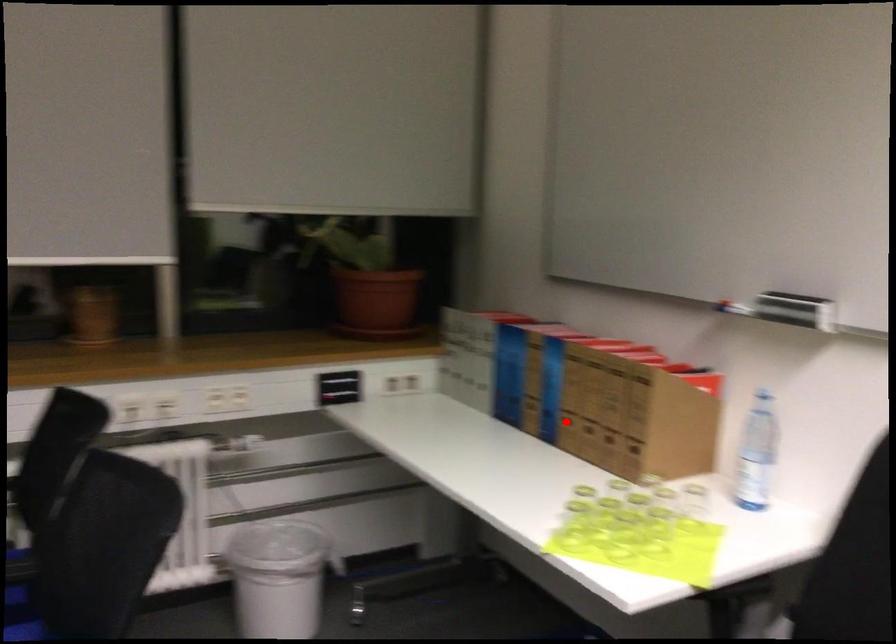
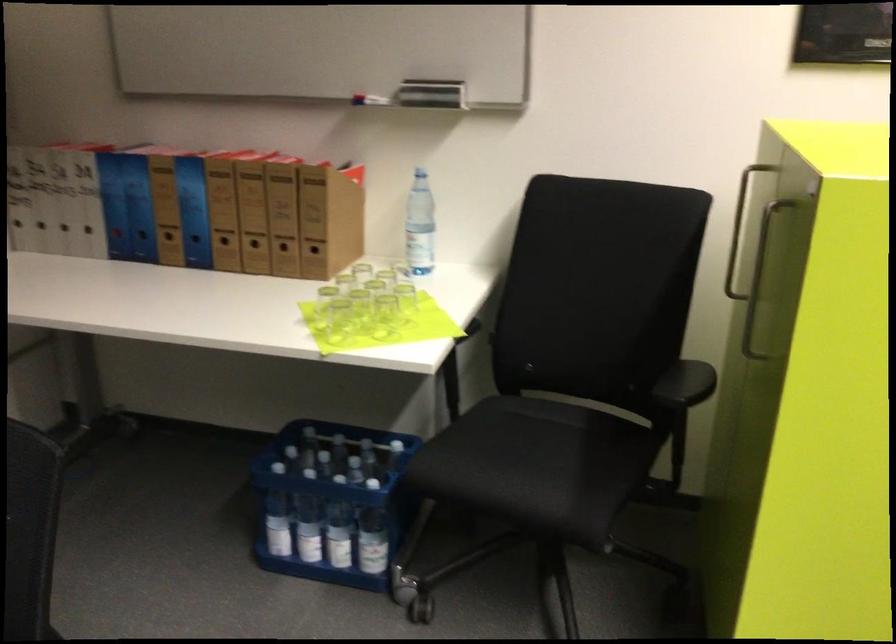
In the second image, find the point that corresponds to the highlighted location in the first image.

(225, 245)